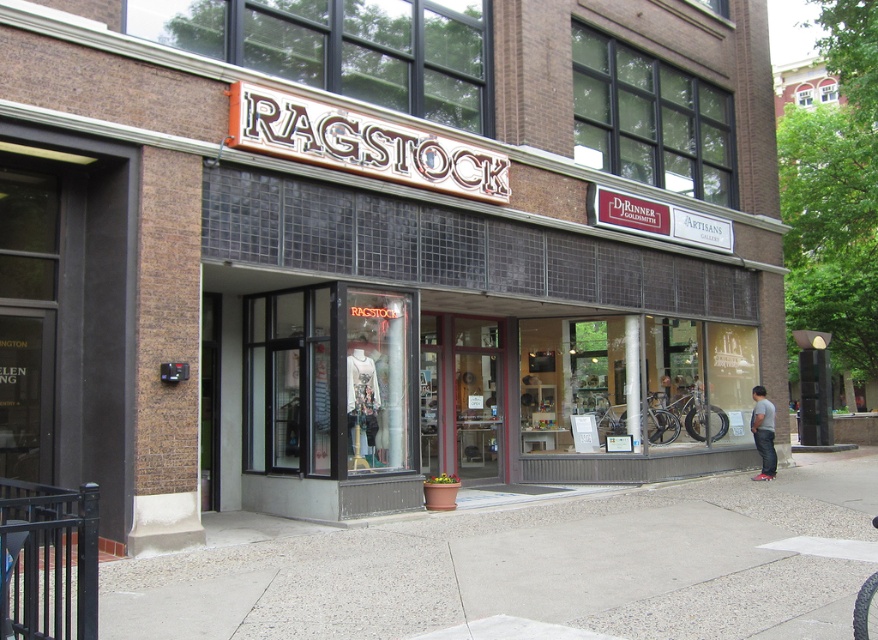
In the scene shown: You are a customer standing outside the RAGSTOCK store entrance. You see the gray concrete pavement at center and the gray cotton shirt at lower right. Which object is closer to your feet?

The gray concrete pavement at center is positioned under the gray cotton shirt at lower right, so the gray concrete pavement at center is closer to your feet.

You are standing at the entrance of RAGSTOCK and want to place a small potted plant on the gray concrete pavement at center. Where exactly should you place it?

The gray concrete pavement at center is located at point 2D coordinates of [530,564], so you should place the small potted plant there.

You are a delivery person trying to park your 1.2 meter wide cart between the gray concrete pavement at center and the gray cotton shirt at lower right. Can you fit your cart there?

The gray concrete pavement at center might be wider than gray cotton shirt at lower right, but since the width of the gray concrete pavement at center is not specified, it is uncertain if the 1.2 meter wide cart can fit between them.